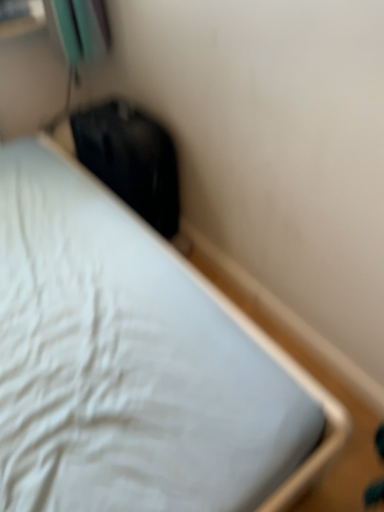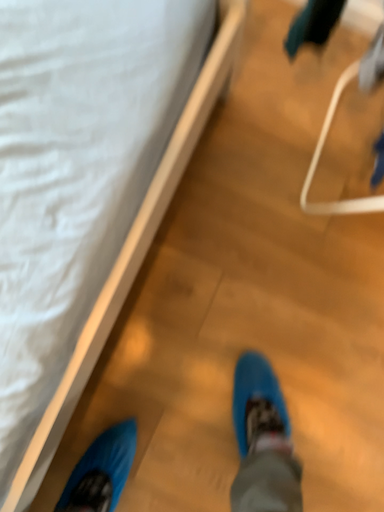
Question: How did the camera likely rotate when shooting the video?

Choices:
 (A) rotated right
 (B) rotated left

Answer: (A)